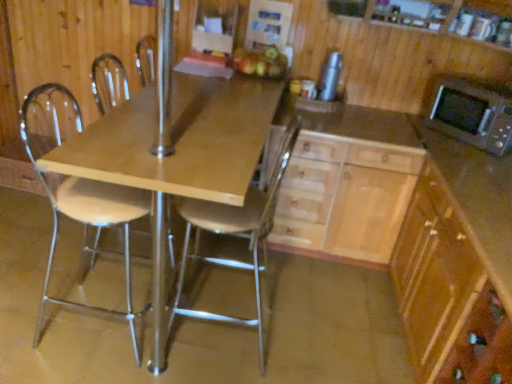
The image size is (512, 384). I want to click on vacant area that lies between metallic silver chair at center, which is counted as the second chair, starting from the left, and white plastic chair at left, the second chair viewed from the right, so click(184, 346).